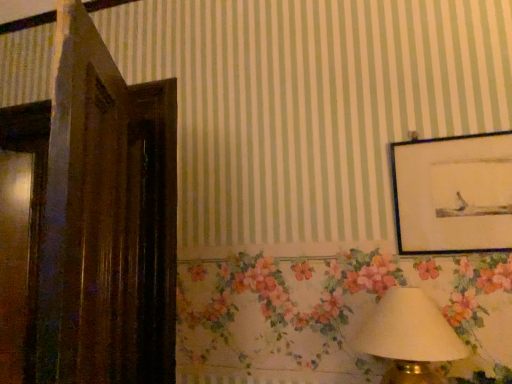
Question: From the image's perspective, does white fabric lampshade at lower right appear lower than matte black picture frame at upper right?

Choices:
 (A) yes
 (B) no

Answer: (A)

Question: Is white fabric lampshade at lower right located outside matte black picture frame at upper right?

Choices:
 (A) no
 (B) yes

Answer: (B)

Question: Considering the relative sizes of white fabric lampshade at lower right and matte black picture frame at upper right in the image provided, is white fabric lampshade at lower right shorter than matte black picture frame at upper right?

Choices:
 (A) no
 (B) yes

Answer: (B)

Question: Can you confirm if white fabric lampshade at lower right is positioned to the right of matte black picture frame at upper right?

Choices:
 (A) no
 (B) yes

Answer: (A)

Question: From the image's perspective, does white fabric lampshade at lower right appear higher than matte black picture frame at upper right?

Choices:
 (A) yes
 (B) no

Answer: (B)

Question: Could you tell me if white fabric lampshade at lower right is turned towards matte black picture frame at upper right?

Choices:
 (A) yes
 (B) no

Answer: (B)

Question: Does matte black picture frame at upper right turn towards white fabric lampshade at lower right?

Choices:
 (A) no
 (B) yes

Answer: (A)

Question: Is matte black picture frame at upper right smaller than white fabric lampshade at lower right?

Choices:
 (A) yes
 (B) no

Answer: (A)

Question: From the image's perspective, is matte black picture frame at upper right over white fabric lampshade at lower right?

Choices:
 (A) yes
 (B) no

Answer: (A)

Question: Does matte black picture frame at upper right come behind white fabric lampshade at lower right?

Choices:
 (A) yes
 (B) no

Answer: (A)

Question: Is white fabric lampshade at lower right surrounded by matte black picture frame at upper right?

Choices:
 (A) no
 (B) yes

Answer: (A)

Question: Considering the relative sizes of matte black picture frame at upper right and white fabric lampshade at lower right in the image provided, is matte black picture frame at upper right taller than white fabric lampshade at lower right?

Choices:
 (A) no
 (B) yes

Answer: (B)

Question: From a real-world perspective, is matte black picture frame at upper right positioned above or below white fabric lampshade at lower right?

Choices:
 (A) below
 (B) above

Answer: (B)